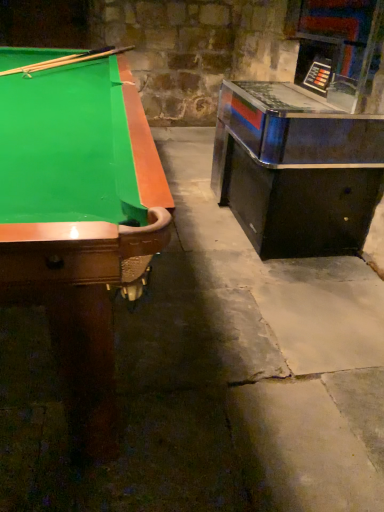
Question: Should I look upward or downward to see green felt pool table at left?

Choices:
 (A) down
 (B) up

Answer: (B)

Question: Is wooden cue at upper left touching green felt pool table at left?

Choices:
 (A) yes
 (B) no

Answer: (B)

Question: Is wooden cue at upper left at the left side of green felt pool table at left?

Choices:
 (A) no
 (B) yes

Answer: (A)

Question: From the image's perspective, does wooden cue at upper left appear higher than green felt pool table at left?

Choices:
 (A) yes
 (B) no

Answer: (A)

Question: Is the depth of wooden cue at upper left less than that of green felt pool table at left?

Choices:
 (A) yes
 (B) no

Answer: (B)

Question: From a real-world perspective, is wooden cue at upper left located beneath green felt pool table at left?

Choices:
 (A) no
 (B) yes

Answer: (A)

Question: Is wooden cue at upper left at the right side of green felt pool table at left?

Choices:
 (A) yes
 (B) no

Answer: (A)

Question: Is green felt pool table at left positioned beyond the bounds of wooden cue at upper left?

Choices:
 (A) no
 (B) yes

Answer: (B)

Question: Does green felt pool table at left have a lesser height compared to wooden cue at upper left?

Choices:
 (A) yes
 (B) no

Answer: (B)

Question: Is green felt pool table at left not close to wooden cue at upper left?

Choices:
 (A) no
 (B) yes

Answer: (A)

Question: Can you confirm if green felt pool table at left is positioned to the right of wooden cue at upper left?

Choices:
 (A) yes
 (B) no

Answer: (B)

Question: Could you tell me if green felt pool table at left is facing wooden cue at upper left?

Choices:
 (A) yes
 (B) no

Answer: (B)

Question: Does green felt pool table at left come behind wooden cue at upper left?

Choices:
 (A) yes
 (B) no

Answer: (B)

Question: Is wooden cue at upper left positioned beyond the bounds of metallic/reflective game machine at right?

Choices:
 (A) yes
 (B) no

Answer: (A)